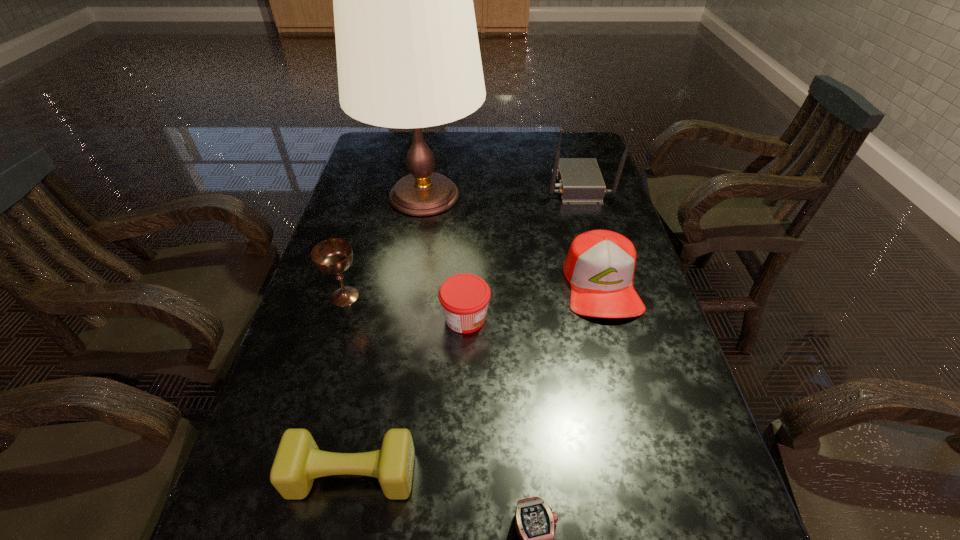
Image resolution: width=960 pixels, height=540 pixels. I want to click on the tallest object, so click(408, 56).

I want to click on the sixth shortest object, so click(580, 181).

At what (x,y) coordinates should I click in order to perform the action: click on the fifth shortest object. Please return your answer as a coordinate pair (x, y). Looking at the image, I should click on (334, 256).

Locate an element on the screen. This screenshot has height=540, width=960. the fourth tallest object is located at coordinates (600, 264).

Identify the location of jam. (464, 298).

Find the location of `the second nearest object`. the second nearest object is located at coordinates (298, 461).

At what (x,y) coordinates should I click in order to perform the action: click on vacant area located on the right of the lamp. Please return your answer as a coordinate pair (x, y). This screenshot has width=960, height=540. Looking at the image, I should click on (596, 196).

The height and width of the screenshot is (540, 960). I want to click on vacant space located 0.050m on the back of the sixth shortest object to connect cables, so click(x=531, y=185).

Find the location of `blank space located 0.050m on the back of the sixth shortest object to connect cables`. blank space located 0.050m on the back of the sixth shortest object to connect cables is located at coordinates (531, 185).

At what (x,y) coordinates should I click in order to perform the action: click on vacant area situated on the back of the sixth shortest object to connect cables. Please return your answer as a coordinate pair (x, y). This screenshot has height=540, width=960. Looking at the image, I should click on (447, 185).